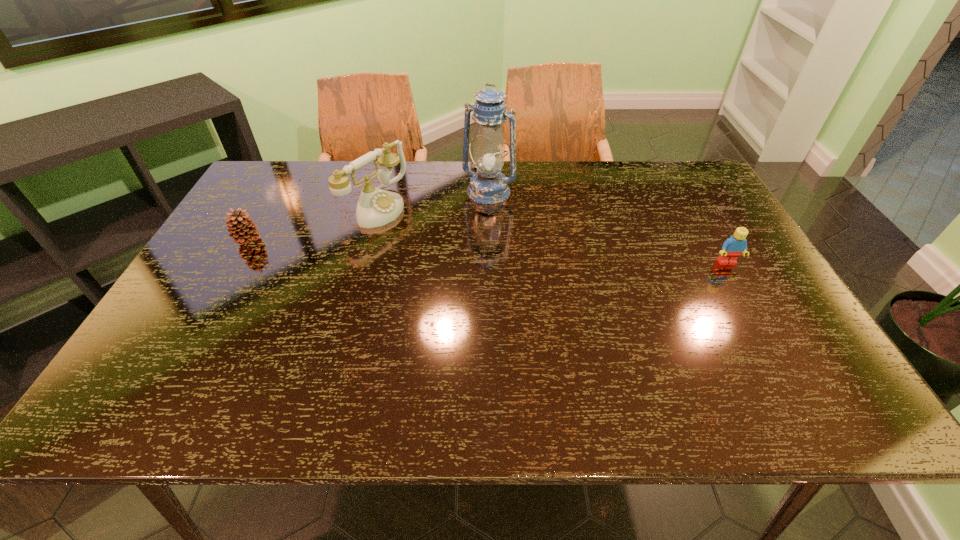
Locate an element on the screen. This screenshot has width=960, height=540. free space on the desktop that is between the pinecone and the Lego and is positioned on the front-facing side of the second object from right to left is located at coordinates (450, 249).

Locate an element on the screen. Image resolution: width=960 pixels, height=540 pixels. free space on the desktop that is between the third farthest object and the Lego and is positioned on the dial of the telephone is located at coordinates (463, 250).